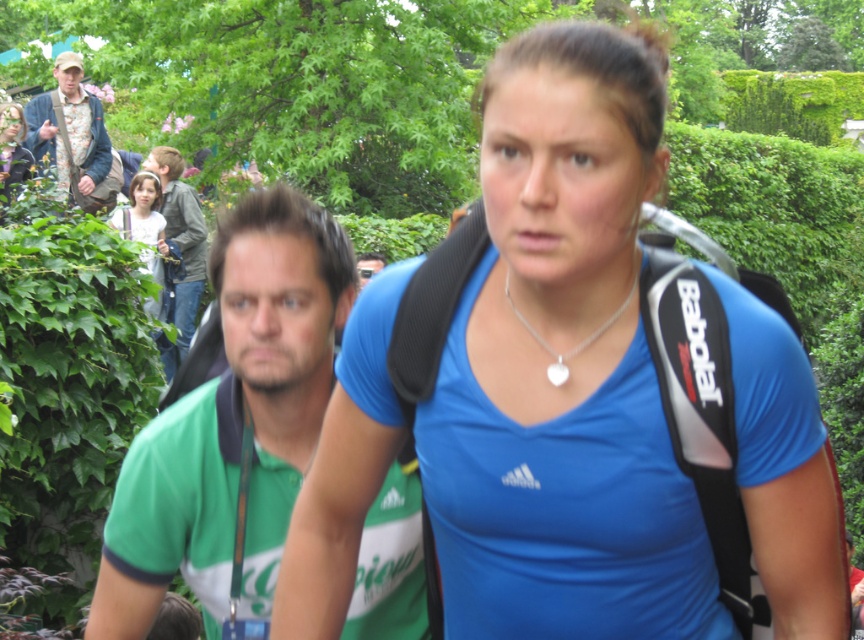
You are a GUI agent. You are given a task and a screenshot of the screen. Output one action in this format:
    pyautogui.click(x=<x>, y=<y>)
    Task: Click on the matte black backpack at upper left
    
    Given the screenshot: What is the action you would take?
    pyautogui.click(x=11, y=150)

Is matte black backpack at upper left closer to the viewer compared to silver/smooth heart at center?

No, matte black backpack at upper left is behind silver/smooth heart at center.

This screenshot has height=640, width=864. Describe the element at coordinates (11, 150) in the screenshot. I see `matte black backpack at upper left` at that location.

Identify the location of matte black backpack at upper left. (11, 150).

Is light brown hair at upper left taller than green fabric shirt at center?

Correct, light brown hair at upper left is much taller as green fabric shirt at center.

How far apart are light brown hair at upper left and green fabric shirt at center?

They are 3.43 meters apart.

Is point (151, 248) farther from camera compared to point (359, 268)?

Yes, point (151, 248) is behind point (359, 268).

The width and height of the screenshot is (864, 640). Identify the location of light brown hair at upper left. (144, 221).

Based on the photo, is green fabric shirt at left bigger than floral-patterned shirt at upper left?

No.

Is the position of green fabric shirt at left more distant than that of floral-patterned shirt at upper left?

No, it is not.

Locate an element on the screen. Image resolution: width=864 pixels, height=640 pixels. green fabric shirt at left is located at coordinates (233, 422).

Where is `green fabric shirt at left`? green fabric shirt at left is located at coordinates (233, 422).